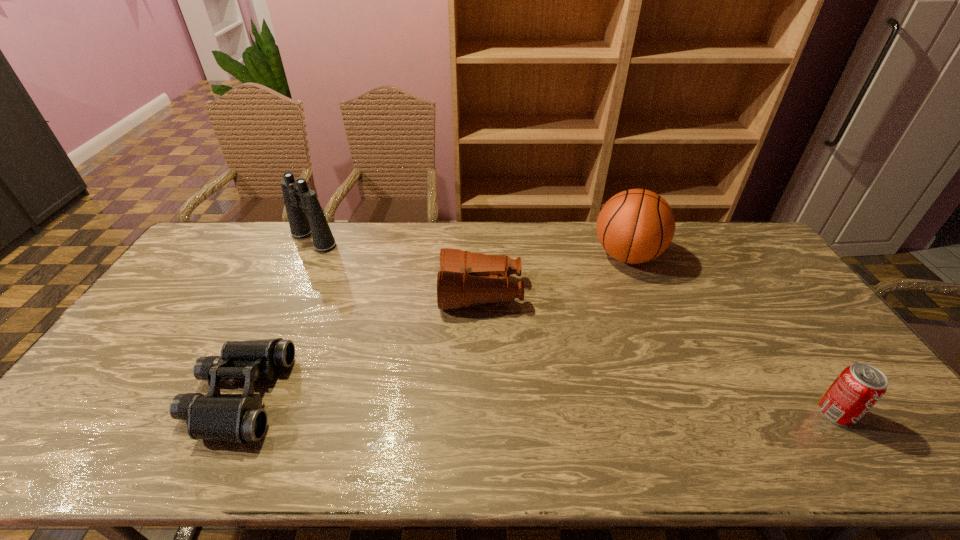
Locate an element on the screen. The width and height of the screenshot is (960, 540). free location that satisfies the following two spatial constraints: 1. on the front side of the farthest binoculars; 2. on the right side of the fourth object from left to right is located at coordinates (305, 256).

Locate an element on the screen. The width and height of the screenshot is (960, 540). free space that satisfies the following two spatial constraints: 1. on the front side of the fourth object from left to right; 2. on the front-facing side of the nearest binoculars is located at coordinates (684, 396).